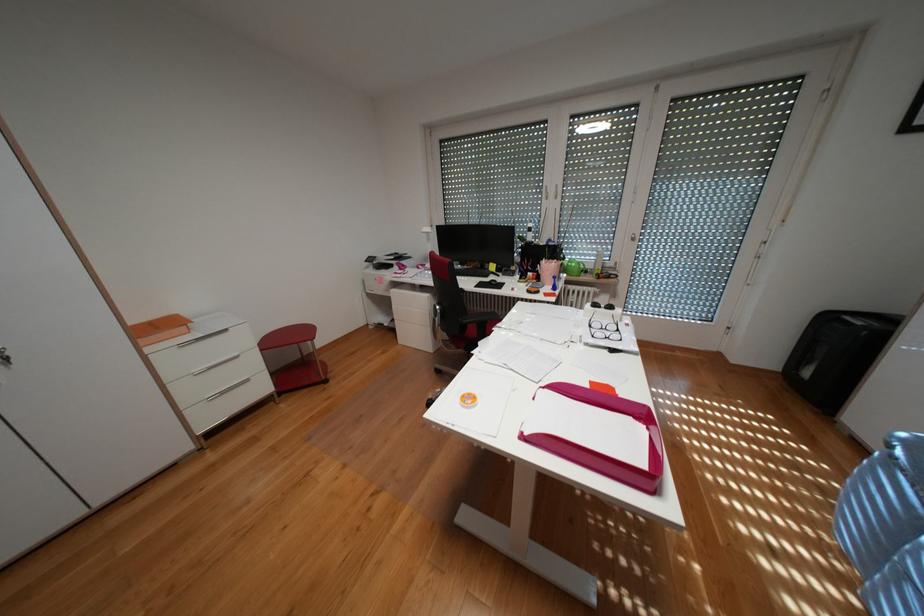
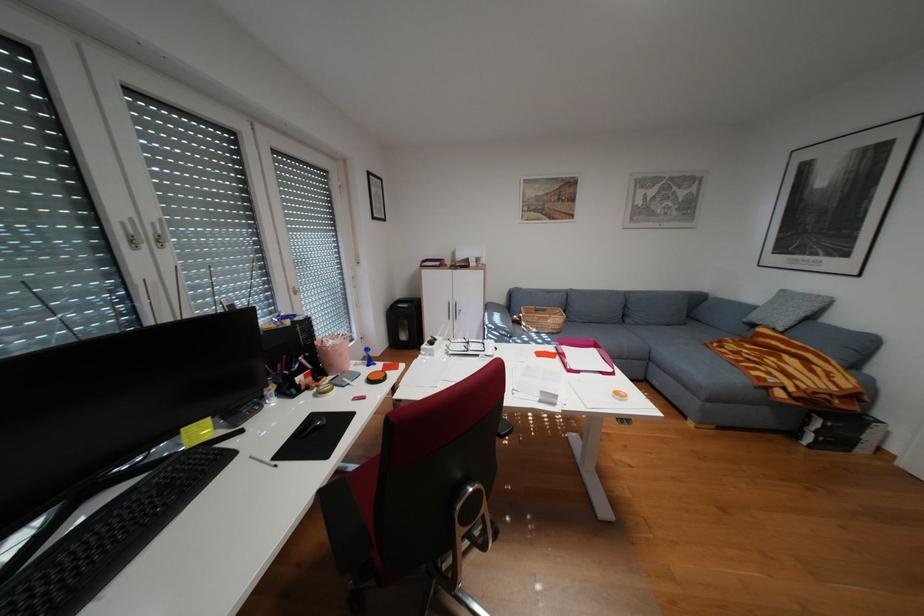
Find the pixel in the second image that matches (x=614, y=310) in the first image.

(448, 342)